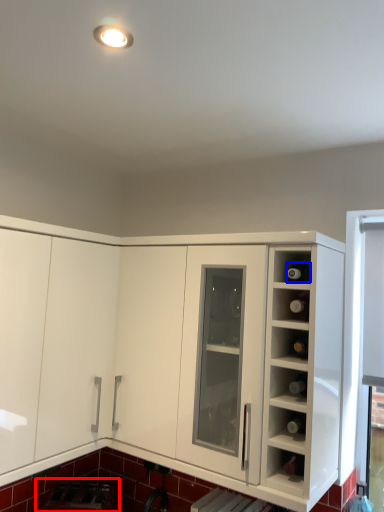
Question: Which object appears closest to the camera in this image, appliance (highlighted by a red box) or wine bottle (highlighted by a blue box)?

Choices:
 (A) appliance
 (B) wine bottle

Answer: (B)